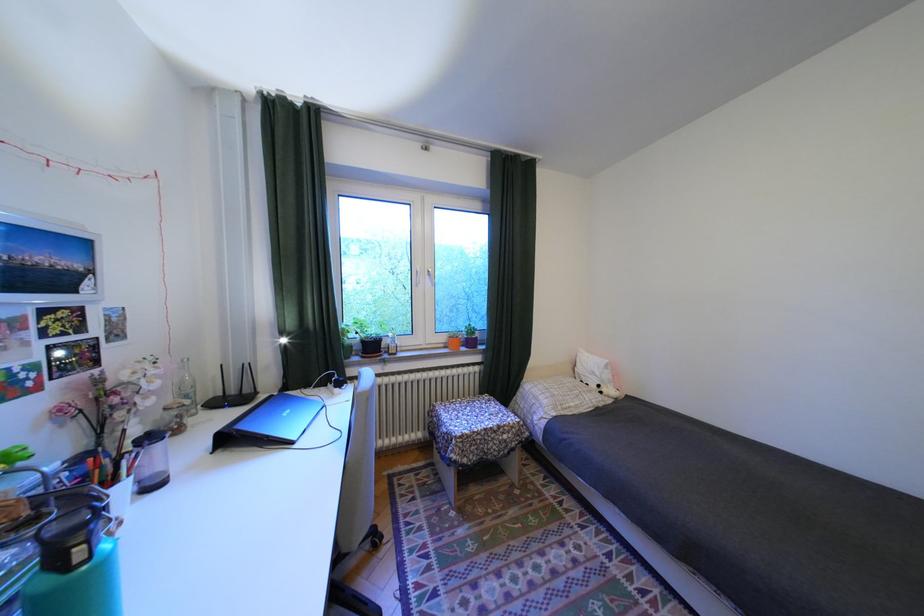
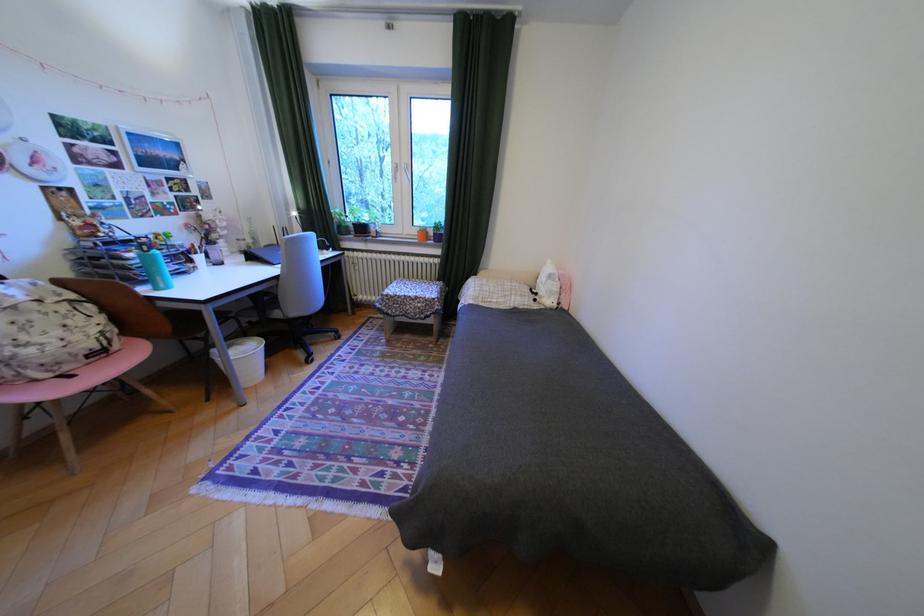
Where in the second image is the point corresponding to (x=455, y=339) from the first image?

(427, 232)